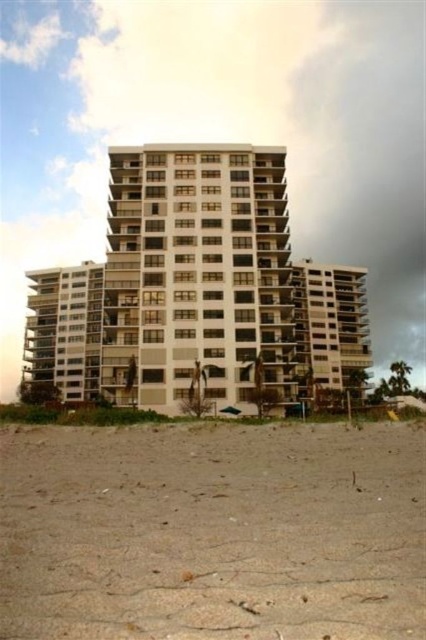
Who is more forward, [409,570] or [322,317]?

Point [409,570]

Can you confirm if brown sandy beach at lower center is shorter than white smooth building at center?

Correct, brown sandy beach at lower center is not as tall as white smooth building at center.

Is point (291, 496) in front of point (284, 333)?

Yes, point (291, 496) is in front of point (284, 333).

I want to click on brown sandy beach at lower center, so click(x=213, y=532).